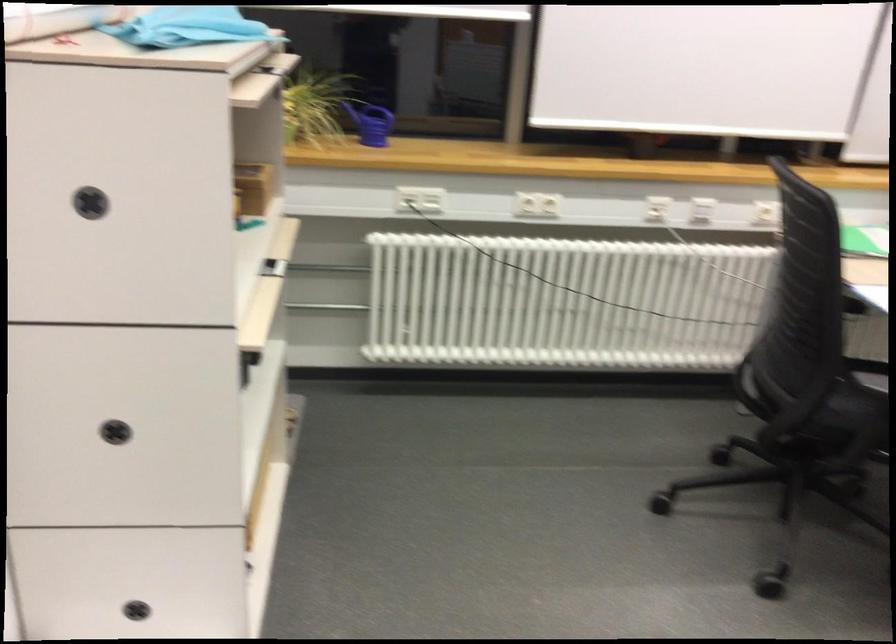
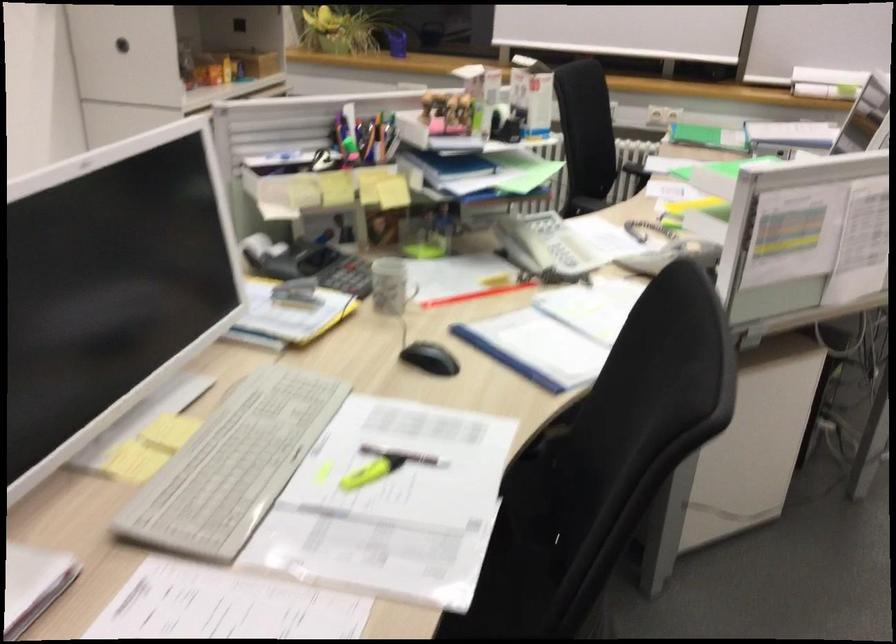
Question: I am providing you with two images of the same scene from different viewpoints. Which of the following objects are not visible in image2?

Choices:
 (A) black stapler
 (B) white power outlet
 (C) metal pot side handle
 (D) black chair sitting surface

Answer: (B)